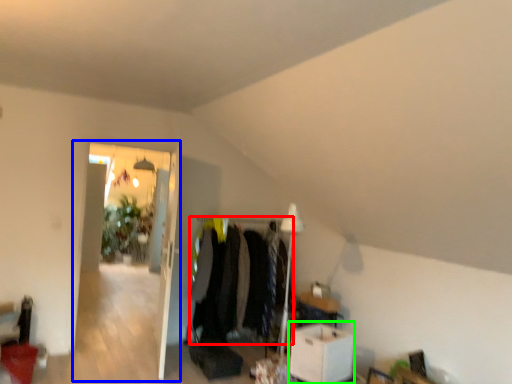
Question: Estimate the real-world distances between objects in this image. Which object is farther from clothing (highlighted by a red box), glass door (highlighted by a blue box) or table (highlighted by a green box)?

Choices:
 (A) glass door
 (B) table

Answer: (A)